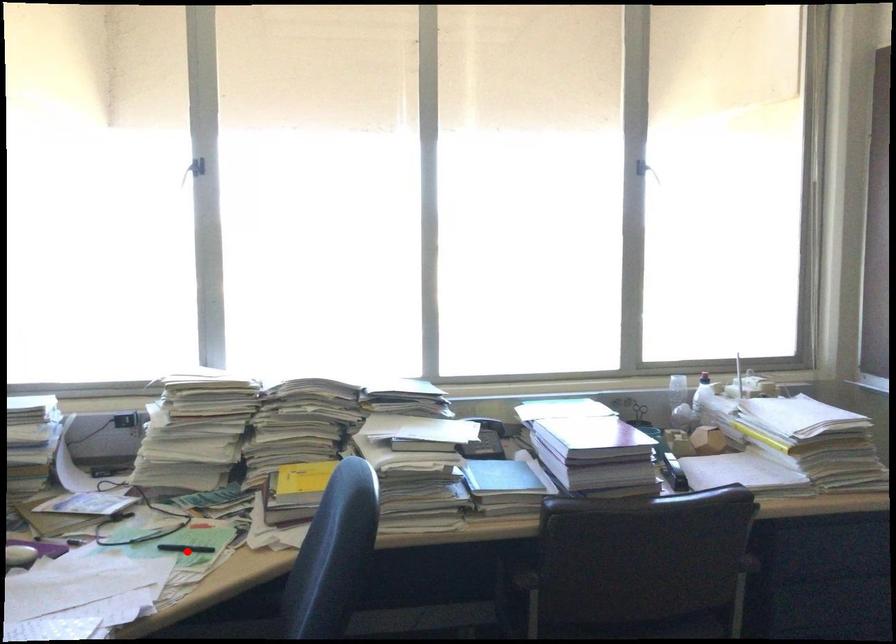
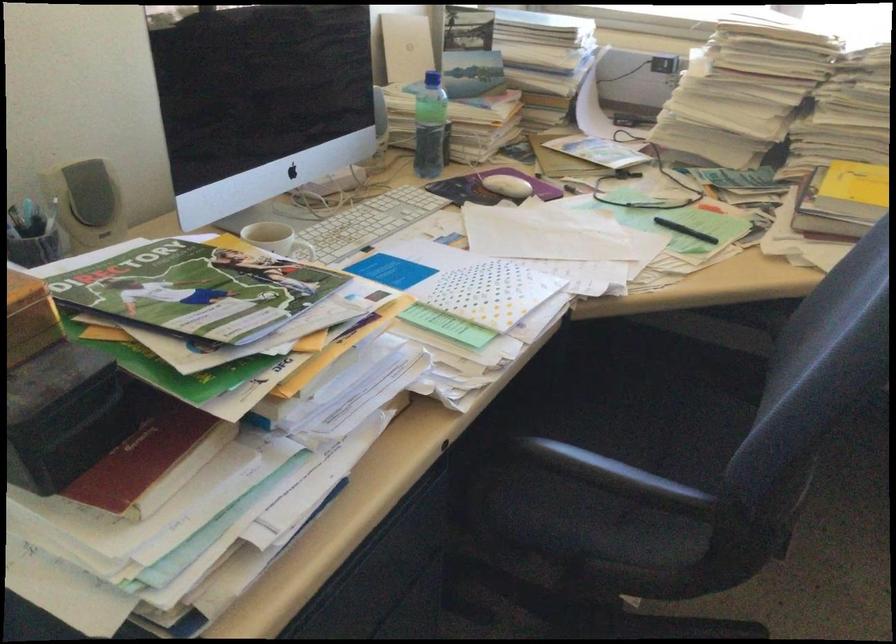
Question: I am providing you with two images of the same scene from different viewpoints. Image1 has a red point marked. In image2, the corresponding 3D location appears at what relative position? Reply with the corresponding letter.

Choices:
 (A) Closer
 (B) Farther

Answer: (A)